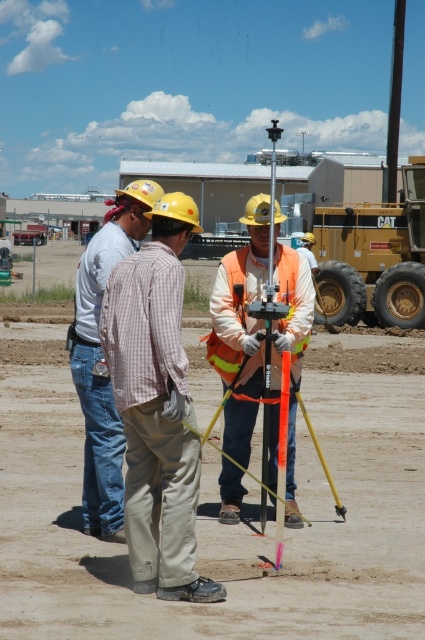
You are standing at the construction site and want to determine which of the two points, point [155,365] or point [300,362], is nearer to you. Based on the scene description, can you identify the closer point?

Point [155,365] is closer to the viewer than point [300,362].

You are a safety inspector at the construction site. You need to ensure that the plaid cotton shirt at center and the metallic silver pole at center are arranged in a safe manner. According to the scene, which object is located below the other?

The plaid cotton shirt at center is positioned under the metallic silver pole at center, meaning the shirt is below the pole.